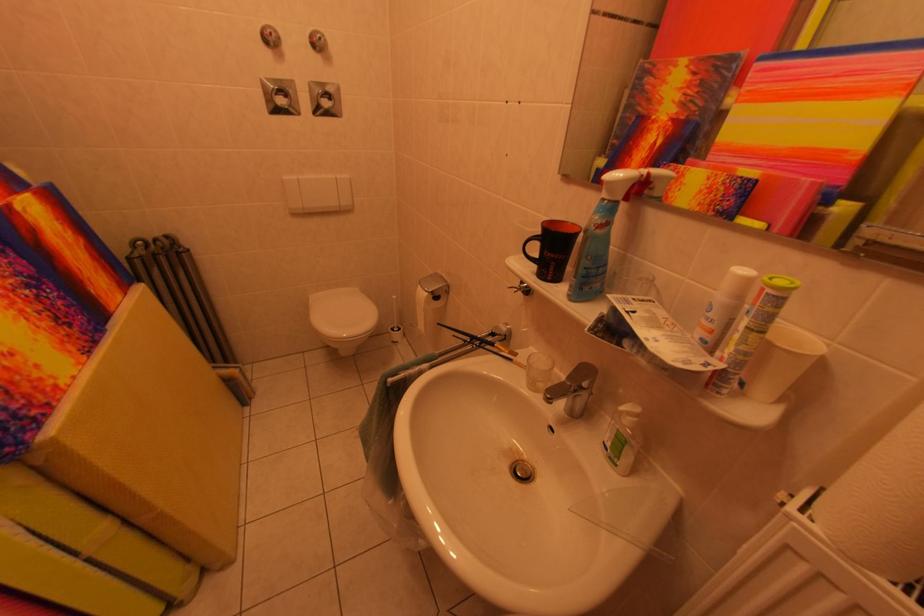
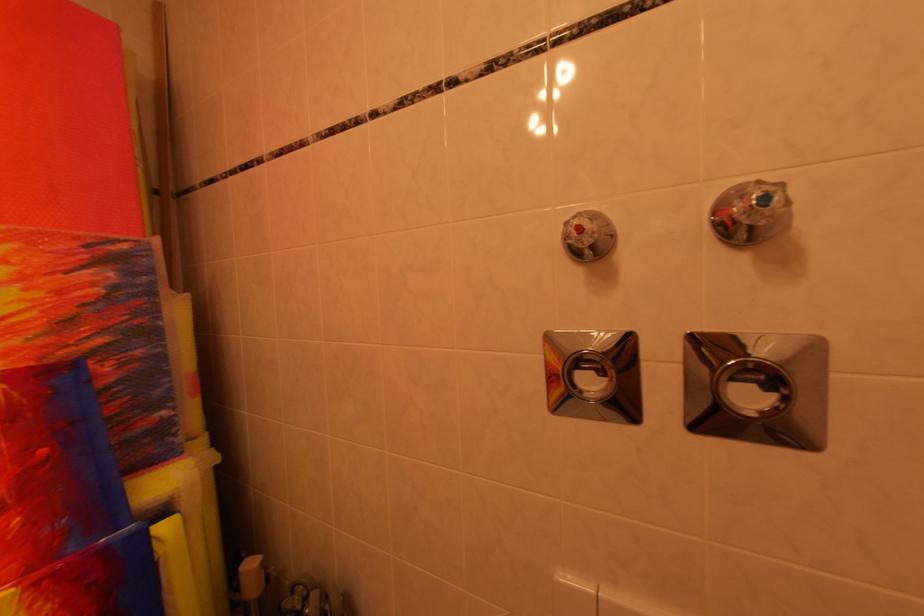
The point at (327, 44) is marked in the first image. Where is the corresponding point in the second image?

(773, 201)